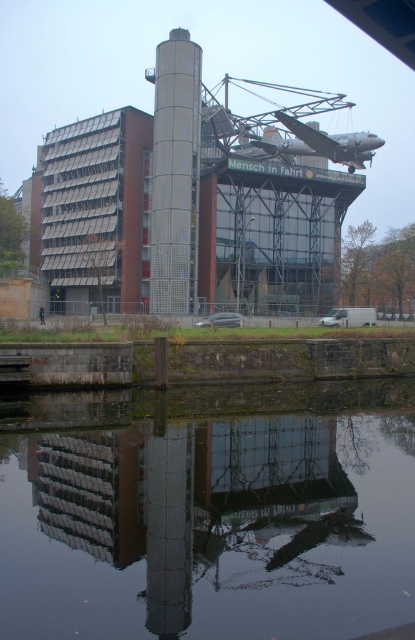
Is point (195, 467) more distant than point (158, 221)?

No, it is in front of (158, 221).

Between transparent glass water at center and gray metallic silo at center, which one has more height?

With more height is gray metallic silo at center.

Is point (204, 396) farther from camera compared to point (153, 161)?

No, (204, 396) is closer to viewer.

Locate an element on the screen. transparent glass water at center is located at coordinates click(x=207, y=513).